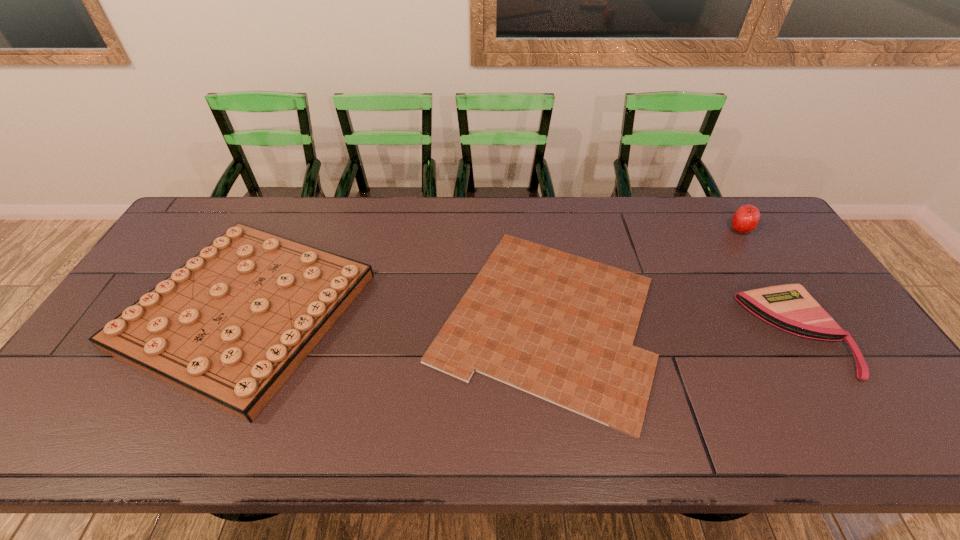
In order to click on apple that is at the far edge in this screenshot , I will do `click(746, 218)`.

Find the location of a particular element. The height and width of the screenshot is (540, 960). object at the left edge is located at coordinates (230, 326).

Find the location of a particular element. apple located in the right edge section of the desktop is located at coordinates (746, 218).

Find the location of a particular element. wristlet that is at the right edge is located at coordinates (789, 307).

This screenshot has height=540, width=960. I want to click on object that is at the far left corner, so click(x=230, y=326).

The width and height of the screenshot is (960, 540). Find the location of `object present at the near left corner`. object present at the near left corner is located at coordinates (230, 326).

This screenshot has width=960, height=540. I want to click on object located at the far right corner, so click(746, 218).

You are a GUI agent. You are given a task and a screenshot of the screen. Output one action in this format:
    pyautogui.click(x=<x>, y=<y>)
    Task: Click on the vacant region at the far edge of the desktop
    Image resolution: width=960 pixels, height=540 pixels.
    Given the screenshot: What is the action you would take?
    pyautogui.click(x=600, y=236)

At what (x,y) coordinates should I click in order to perform the action: click on free spot at the near edge of the desktop. Please return your answer as a coordinate pair (x, y). Image resolution: width=960 pixels, height=540 pixels. Looking at the image, I should click on (634, 438).

I want to click on free region at the left edge, so click(x=127, y=393).